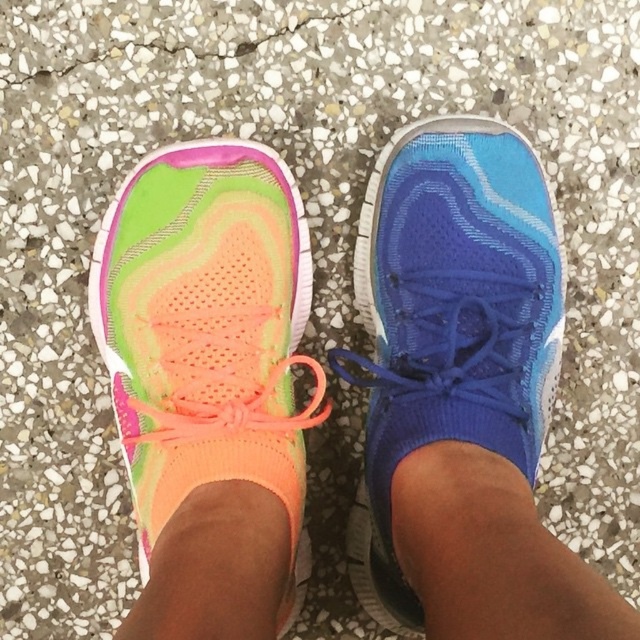
Question: Which point is farther to the camera?

Choices:
 (A) (177, 246)
 (B) (515, 380)
 (C) (384, 332)

Answer: (C)

Question: Which is nearer to the neon mesh shoe at left?

Choices:
 (A) neon mesh shoe at center
 (B) blue mesh shoe at center

Answer: (A)

Question: Does neon mesh shoe at left appear under neon mesh shoe at center?

Choices:
 (A) no
 (B) yes

Answer: (B)

Question: Can you confirm if neon mesh shoe at center is thinner than blue mesh shoe at center?

Choices:
 (A) yes
 (B) no

Answer: (B)

Question: Which object appears farthest from the camera in this image?

Choices:
 (A) blue mesh shoe at center
 (B) neon mesh shoe at center

Answer: (B)

Question: From the image, what is the correct spatial relationship of neon mesh shoe at center in relation to blue mesh shoe at center?

Choices:
 (A) below
 (B) above

Answer: (A)